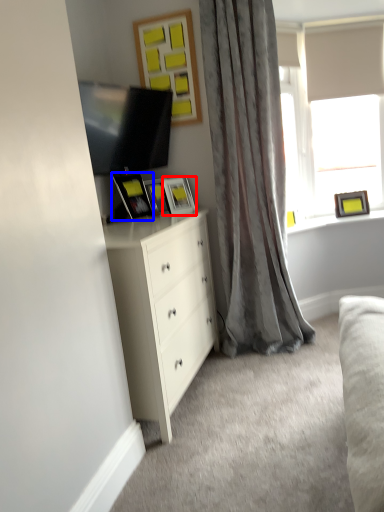
Question: Among these objects, which one is nearest to the camera, picture frame (highlighted by a red box) or picture frame (highlighted by a blue box)?

Choices:
 (A) picture frame
 (B) picture frame

Answer: (B)